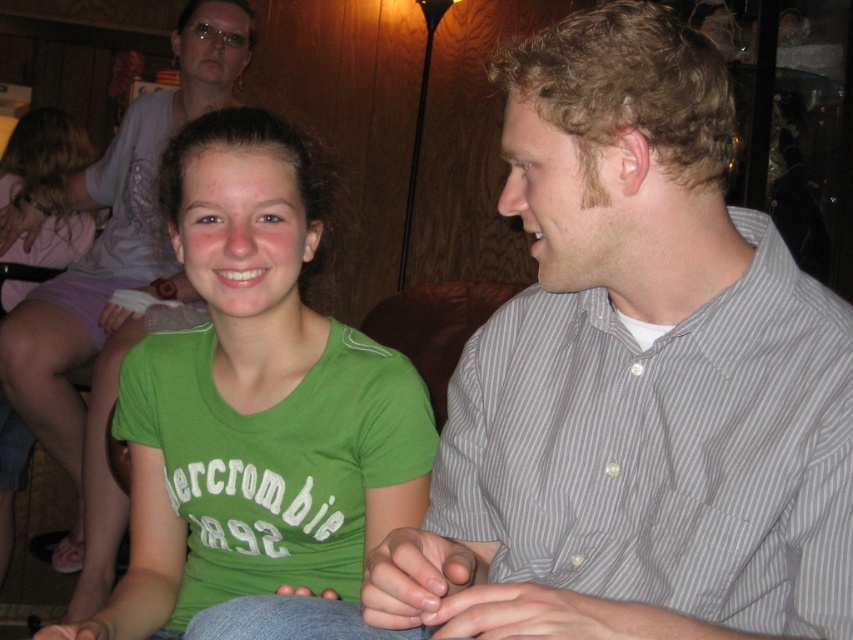
Question: Which object appears closest to the camera in this image?

Choices:
 (A) gray striped shirt at right
 (B) green t-shirt at center
 (C) green fabric shirt at center

Answer: (A)

Question: Which of these objects is positioned closest to the gray striped shirt at right?

Choices:
 (A) green t-shirt at center
 (B) green fabric shirt at center

Answer: (B)

Question: Is gray striped shirt at right wider than green t-shirt at center?

Choices:
 (A) yes
 (B) no

Answer: (B)

Question: Which of the following is the closest to the observer?

Choices:
 (A) green fabric shirt at center
 (B) green t-shirt at center
 (C) gray striped shirt at right

Answer: (C)

Question: Does gray striped shirt at right appear under green t-shirt at center?

Choices:
 (A) no
 (B) yes

Answer: (B)

Question: Is gray striped shirt at right closer to camera compared to green t-shirt at center?

Choices:
 (A) no
 (B) yes

Answer: (B)